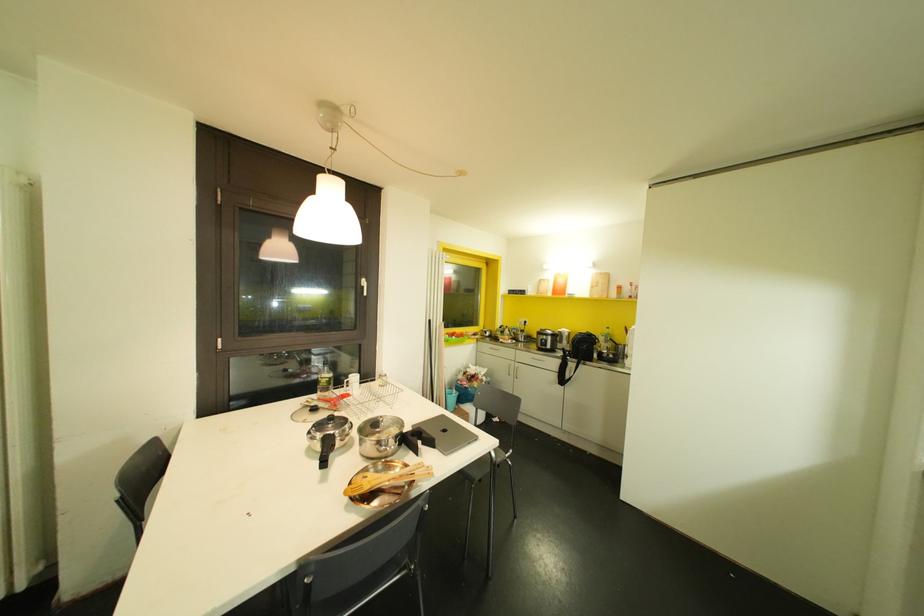
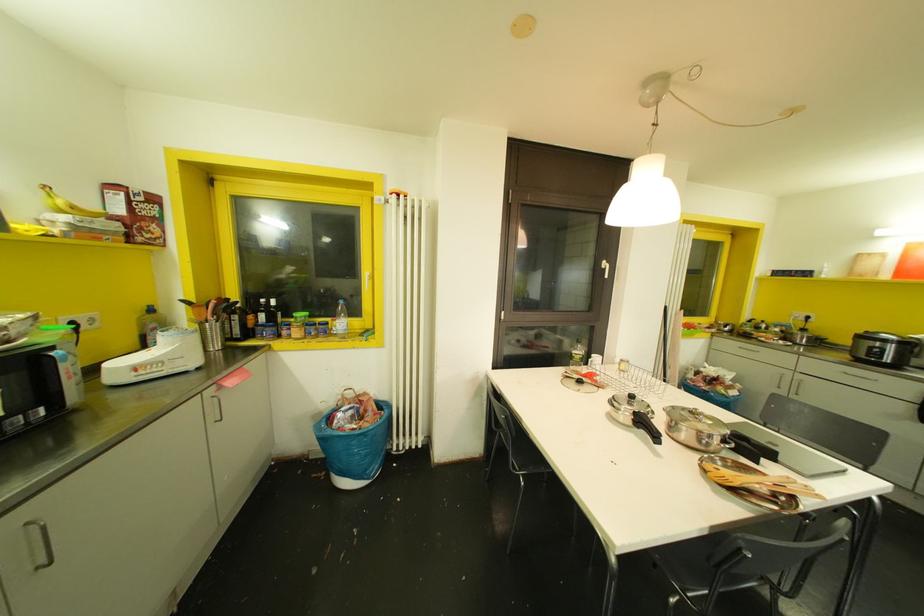
Locate, in the second image, the point that corresponds to the point at 321,468 in the first image.

(660, 444)